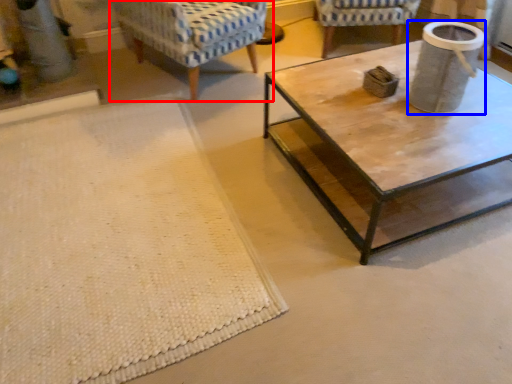
Question: Among these objects, which one is nearest to the camera, chair (highlighted by a red box) or gray (highlighted by a blue box)?

Choices:
 (A) chair
 (B) gray

Answer: (B)